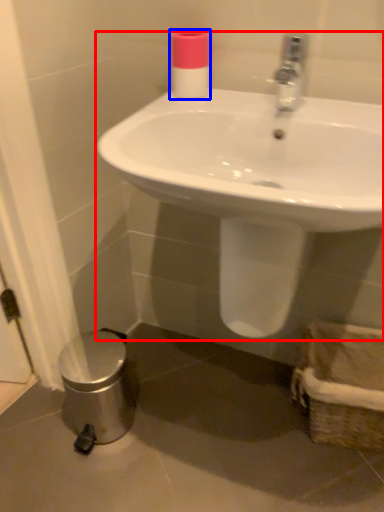
Question: Among these objects, which one is farthest to the camera, sink (highlighted by a red box) or toiletry (highlighted by a blue box)?

Choices:
 (A) sink
 (B) toiletry

Answer: (B)